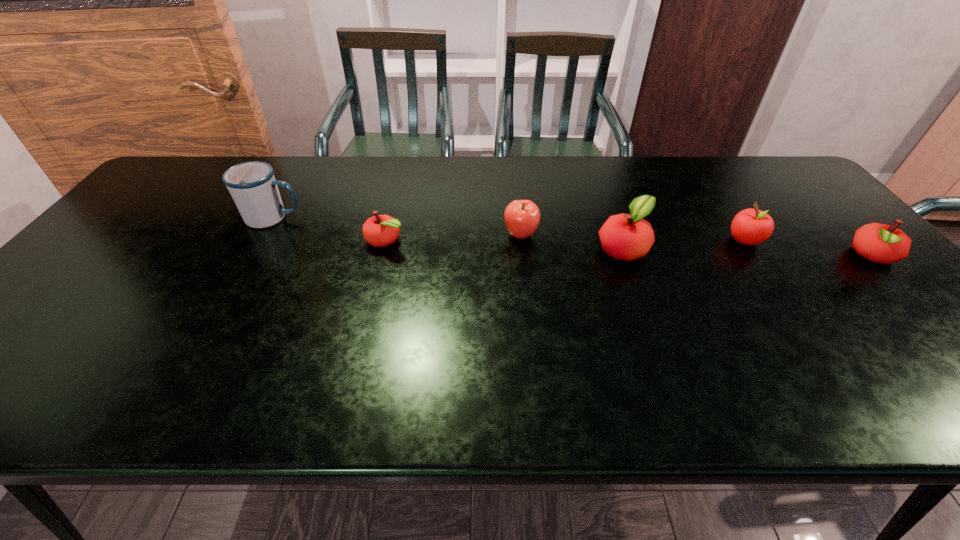
The apples are evenly distributed in the image. To maintain this, where would you place another apple on the left? Please point to a free space. Please provide its 2D coordinates. Your answer should be formatted as a tuple, i.e. [(x, y)], where the tuple contains the x and y coordinates of a point satisfying the conditions above.

[(156, 233)]